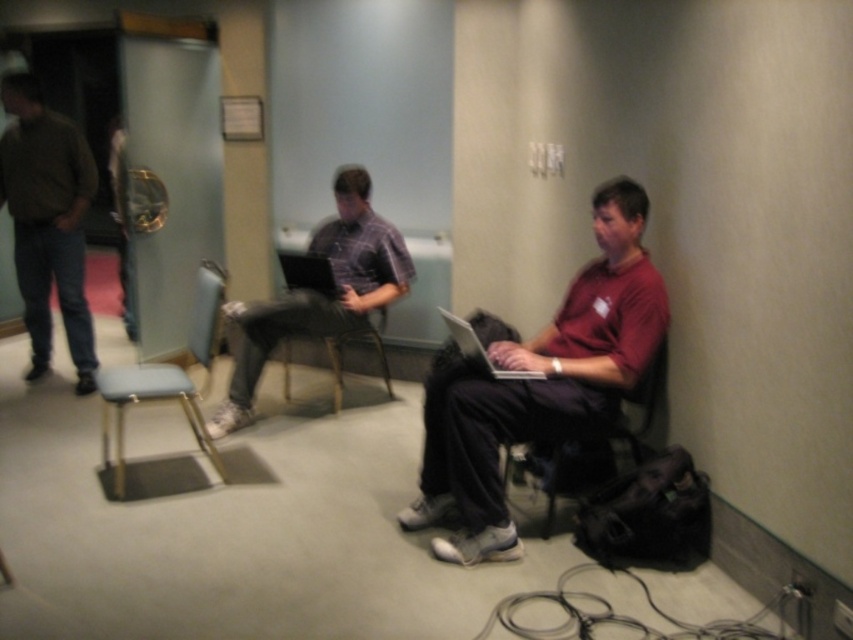
You are a delivery person who needs to place a package on the silver metallic laptop at center. The package is 5 feet long. Can you place it on the laptop without moving the light blue fabric stool at lower left?

The distance between the light blue fabric stool at lower left and the silver metallic laptop at center is 4.64 feet. Since the package is 5 feet long, it cannot be placed on the laptop without moving the stool as the available space is shorter than the package length.

You are standing in the hallway and notice the matte red shirt at center and the light blue fabric stool at lower left. Which object is closer to you?

The matte red shirt at center is closer to you because it is positioned over the light blue fabric stool at lower left, indicating it is in front of it.

You are standing in the hallway and need to place a small plant pot between the light blue fabric stool at lower left and the silver metallic laptop at center. Can you do this without moving either object?

The light blue fabric stool at lower left is located below the silver metallic laptop at center, so there is space between them to place the small plant pot without moving either object.